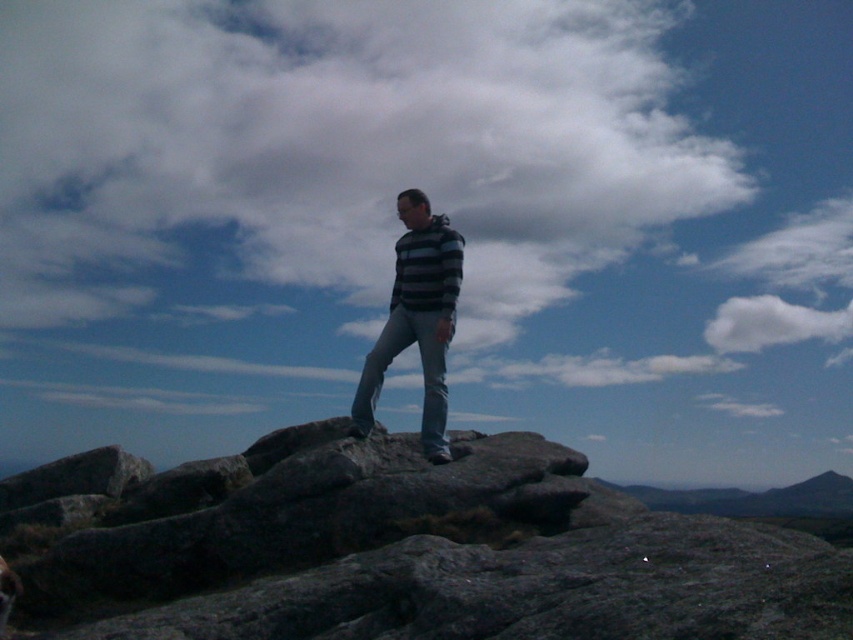
You are a hiker who wants to place a marker at the gray rock at center. The coordinates provided are point (x=404, y=550). Can you confirm if this point is accurate based on the scene?

Yes, the point (x=404, y=550) corresponds to the gray rock at center, so the coordinates are accurate.

You are a photographer trying to capture the scene. You notice two points in the image, point (155, 113) and point (369, 429). If you want to focus on the point closer to the camera, which point should you choose?

Point (369, 429) is closer to the camera than point (155, 113), so you should focus on point (369, 429).

You are a photographer trying to capture the person in the image. Since the striped fabric at center and denim at center are both visible in the frame, which one should you focus on to ensure the subject is clearly visible?

The striped fabric at center is bigger than denim at center, so focusing on the striped fabric at center would ensure the subject is clearly visible due to its larger size.